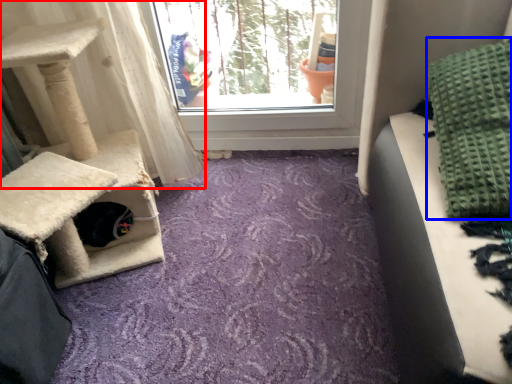
Question: Which object appears closest to the camera in this image, curtain (highlighted by a red box) or blanket (highlighted by a blue box)?

Choices:
 (A) curtain
 (B) blanket

Answer: (B)